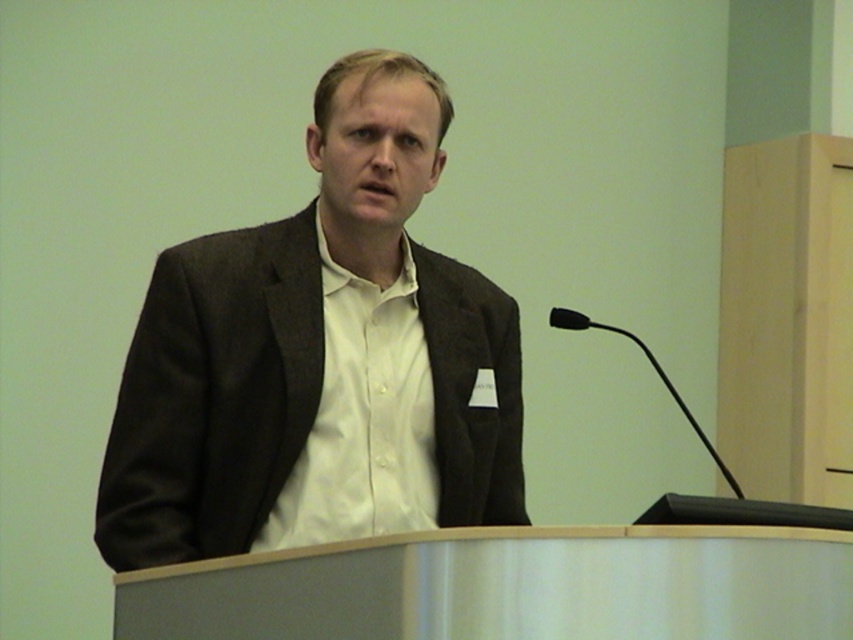
Question: Which object is farther from the camera taking this photo?

Choices:
 (A) matte black suit at center
 (B) white smooth shirt at center

Answer: (B)

Question: Among these objects, which one is nearest to the camera?

Choices:
 (A) white smooth shirt at center
 (B) matte black suit at center

Answer: (B)

Question: Does matte black suit at center have a larger size compared to white smooth shirt at center?

Choices:
 (A) no
 (B) yes

Answer: (B)

Question: Does matte black suit at center appear on the right side of white smooth shirt at center?

Choices:
 (A) no
 (B) yes

Answer: (A)

Question: In this image, where is matte black suit at center located relative to white smooth shirt at center?

Choices:
 (A) above
 (B) below

Answer: (A)